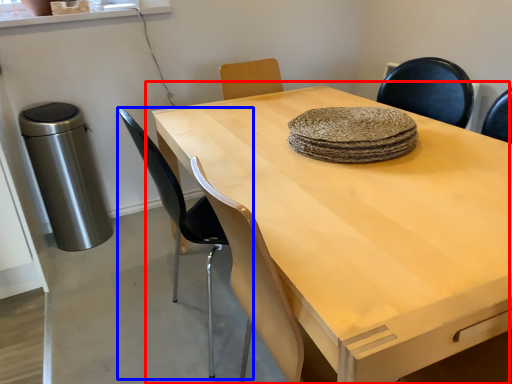
Question: Which object appears farthest to the camera in this image, table (highlighted by a red box) or chair (highlighted by a blue box)?

Choices:
 (A) table
 (B) chair

Answer: (B)